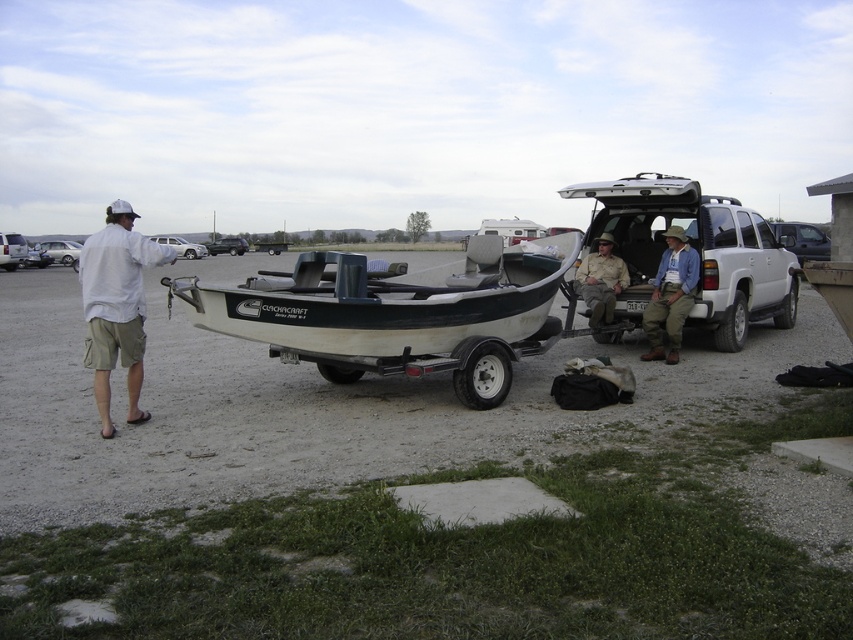
Looking at this image, you are a photographer setting up a shot of the man in the white cotton shirt at left and khaki pants at center. To ensure both are in frame, where should you position your camera relative to the man?

Position the camera to the left of the man so that the white cotton shirt at left and khaki pants at center are both visible in the frame since the white cotton shirt at left is on the left side of khaki pants at center.